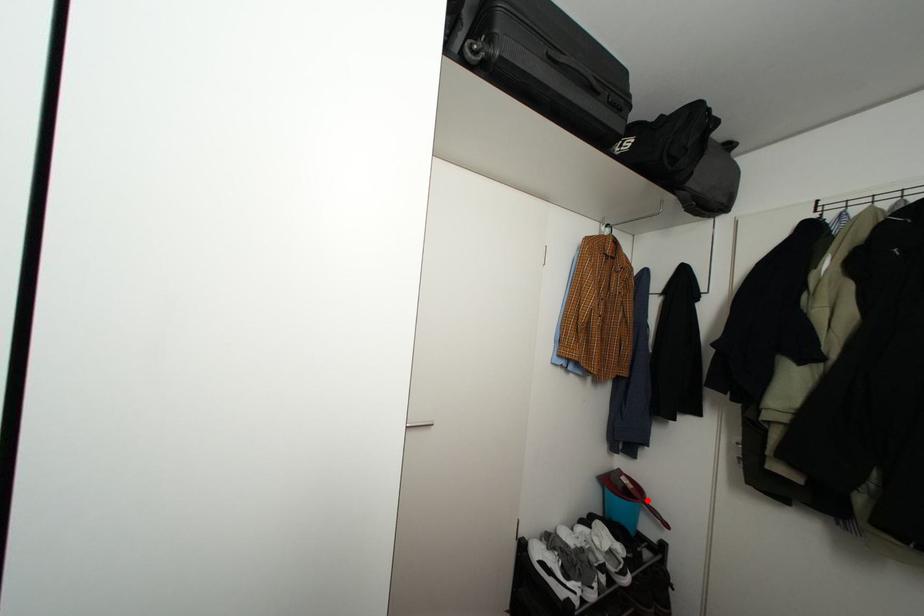
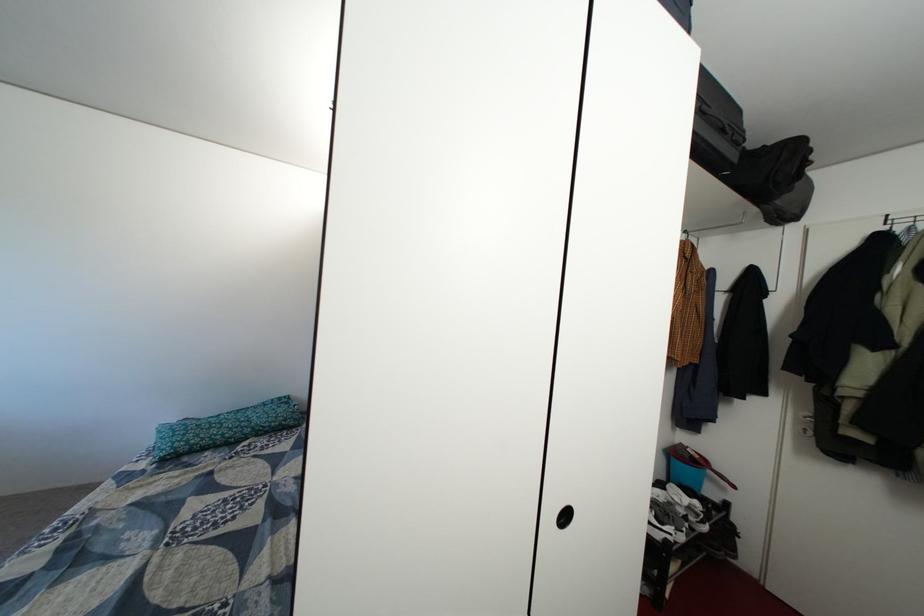
In the second image, find the point that corresponds to the highlighted location in the first image.

(713, 469)